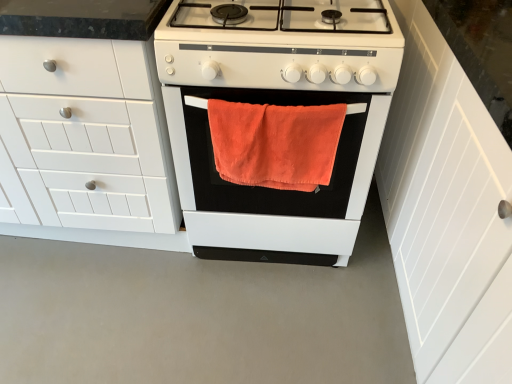
At what (x,y) coordinates should I click in order to perform the action: click on free area in between white matte cabinet at left, acting as the 2th cabinetry starting from the right, and white matte oven at center. Please return your answer as a coordinate pair (x, y). Image resolution: width=512 pixels, height=384 pixels. Looking at the image, I should click on (104, 263).